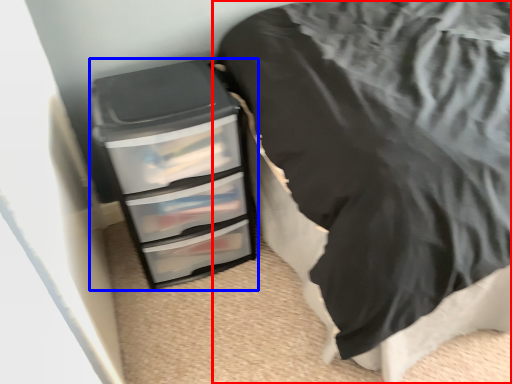
Question: Which object appears closest to the camera in this image, furniture (highlighted by a red box) or chest of drawers (highlighted by a blue box)?

Choices:
 (A) furniture
 (B) chest of drawers

Answer: (A)